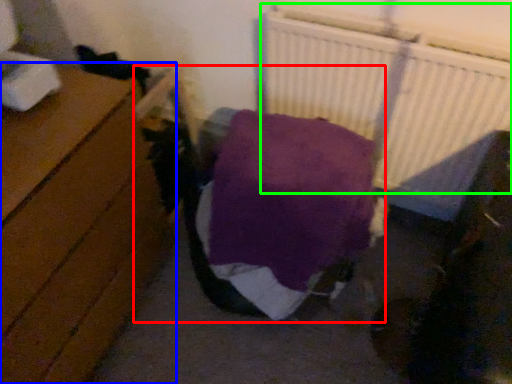
Question: Which is farther away from bed (highlighted by a red box)? furniture (highlighted by a blue box) or radiator (highlighted by a green box)?

Choices:
 (A) furniture
 (B) radiator

Answer: (B)